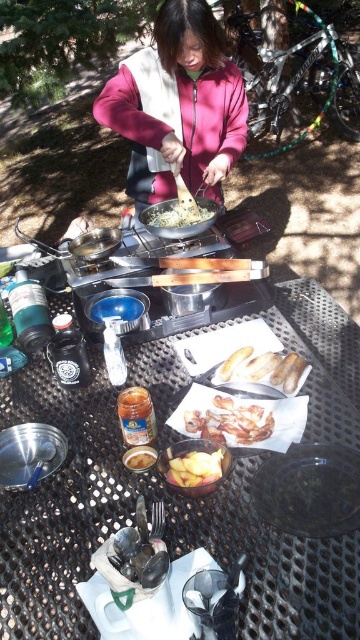
You are setting up a picnic and need to place the black matte platter at lower right and the yellow matte food at center on the table. According to the image, where should you position the black matte platter relative to the yellow matte food?

The black matte platter at lower right should be placed below the yellow matte food at center as per the image description.

You are standing in front of the outdoor cooking setup. There are two points marked on the table. The first point is at coordinates point (213, 456) and the second is at point (216, 209). Which of these points is closer to you?

Point (213, 456) is closer to the viewer than point (216, 209).

What is the position of the point at coordinates (195, 468) in the image?

The point at coordinates (195, 468) is located on the yellow matte potato at center.